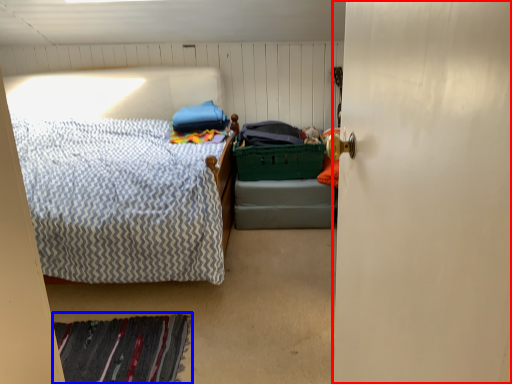
Question: Which point is further to the camera, door (highlighted by a red box) or mat (highlighted by a blue box)?

Choices:
 (A) door
 (B) mat

Answer: (B)